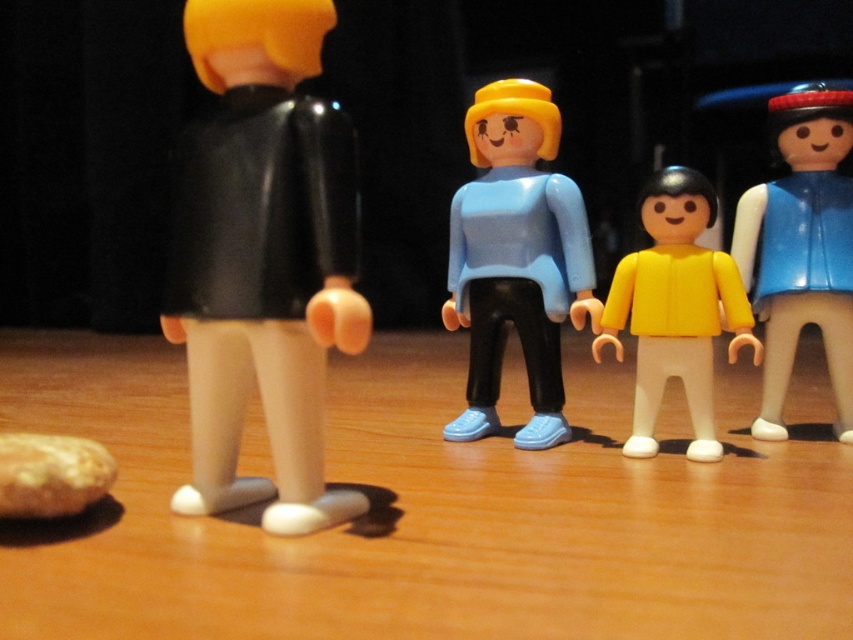
Which of these two, matte black figure at left or yellow matte figure at center, stands shorter?

yellow matte figure at center is shorter.

Does matte black figure at left come behind yellow matte figure at center?

That is False.

Between point (325, 212) and point (648, 317), which one is positioned in front?

Point (325, 212) is more forward.

Identify the location of matte black figure at left. This screenshot has height=640, width=853. (264, 260).

Is matte blue plastic figure at center wider than blue glossy vest at right?

Yes.

Is matte blue plastic figure at center in front of blue glossy vest at right?

That is True.

Where is `matte blue plastic figure at center`? matte blue plastic figure at center is located at coordinates (515, 259).

You are a GUI agent. You are given a task and a screenshot of the screen. Output one action in this format:
    pyautogui.click(x=<x>, y=<y>)
    Task: Click on the blue glossy vest at right
    
    Given the screenshot: What is the action you would take?
    pyautogui.click(x=802, y=248)

Is point (798, 220) positioned after point (730, 259)?

That is True.

Identify the location of blue glossy vest at right. (802, 248).